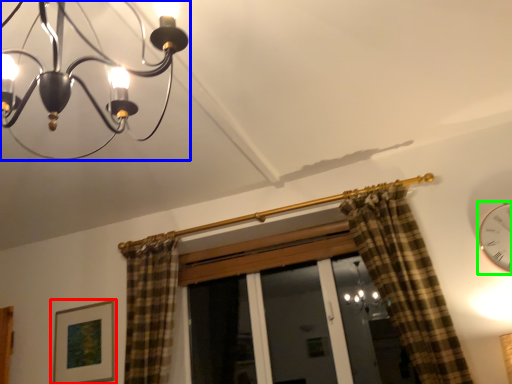
Question: Which object is positioned closest to picture frame (highlighted by a red box)? Select from lamp (highlighted by a blue box) and clock (highlighted by a green box).

Choices:
 (A) lamp
 (B) clock

Answer: (A)